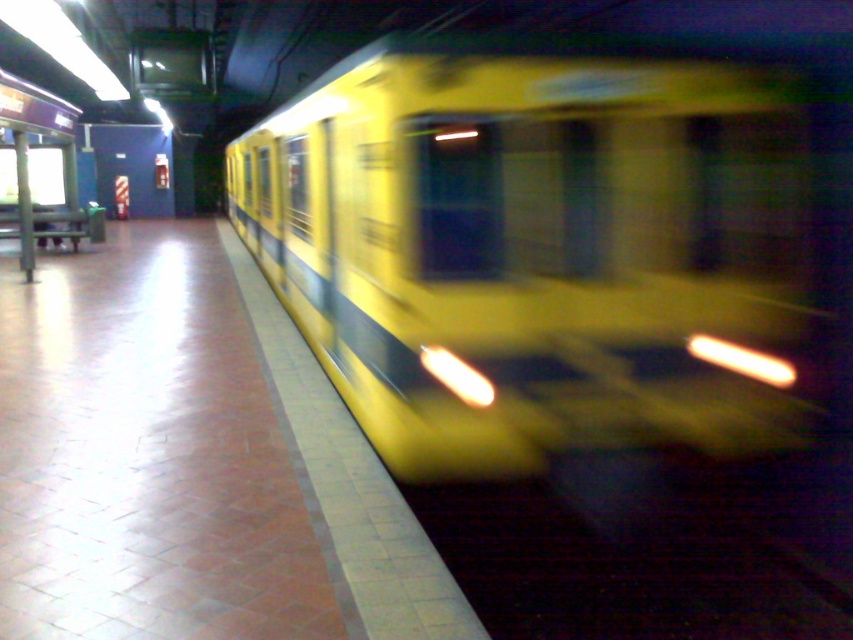
You are a passenger waiting on the subway platform. You notice the yellow matte train at center and the dark rubber train track at lower right. Which object is taller?

The yellow matte train at center is much taller than the dark rubber train track at lower right.

You are a passenger waiting on the subway platform. You notice the yellow matte train at center and the dark rubber train track at lower right. Which object is closer to you as you stand on the platform?

The yellow matte train at center is closer to you because it is positioned over the dark rubber train track at lower right, meaning it is above and nearer to your position on the platform.

You are a photographer trying to capture the yellow matte train at center and the dark rubber train track at lower right in a single frame. Based on their sizes in the image, which object would appear wider?

The yellow matte train at center appears wider than the dark rubber train track at lower right because its width surpasses the track.